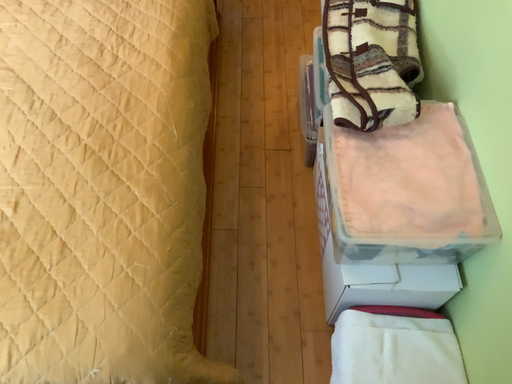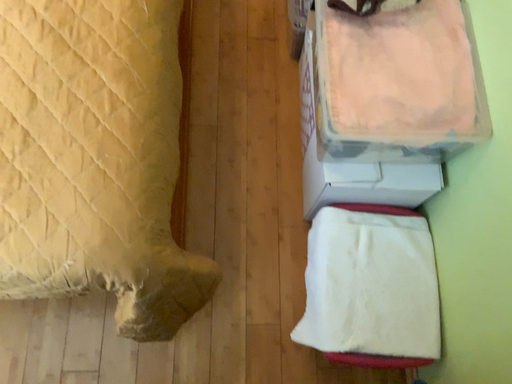
Question: How did the camera likely rotate when shooting the video?

Choices:
 (A) rotated upward
 (B) rotated downward

Answer: (B)